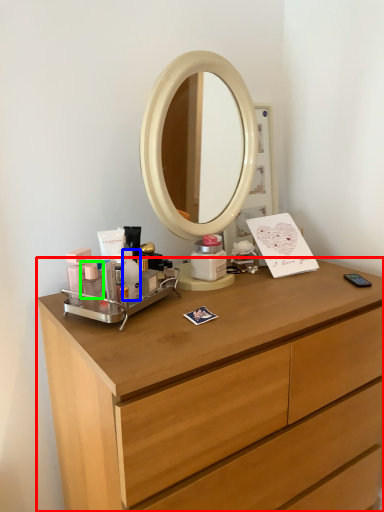
Question: Based on their relative distances, which object is farther from chest of drawers (highlighted by a red box)? Choose from toiletry (highlighted by a blue box) and toiletry (highlighted by a green box).

Choices:
 (A) toiletry
 (B) toiletry

Answer: (B)